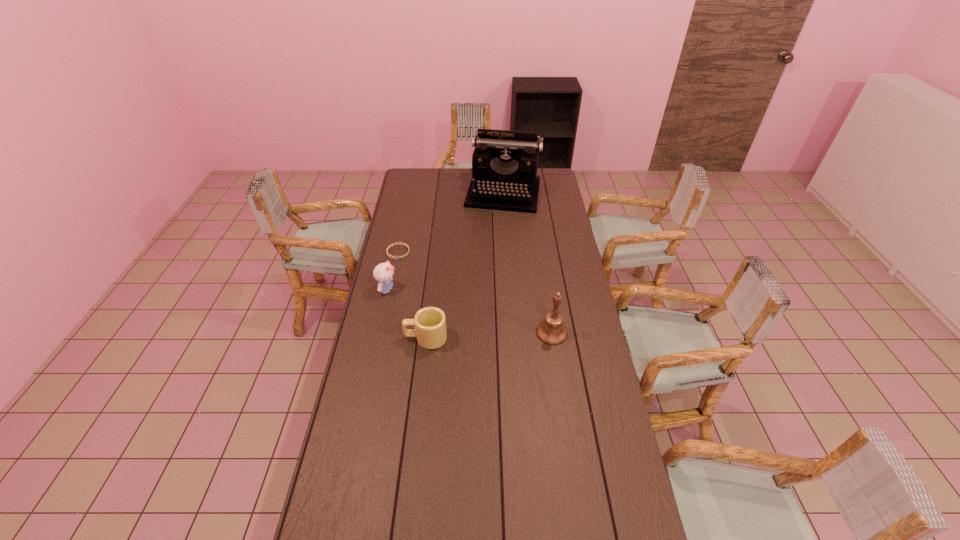
At what (x,y) coordinates should I click in order to perform the action: click on vacant spot on the desktop that is between the third object from right to left and the fourth shortest object and is positioned on the front-facing side of the third tallest object. Please return your answer as a coordinate pair (x, y). Looking at the image, I should click on click(x=501, y=335).

Locate an element on the screen. The width and height of the screenshot is (960, 540). free spot on the desktop that is between the second shortest object and the bell and is positioned on the typing side of the typewriter is located at coordinates (473, 336).

Locate an element on the screen. This screenshot has width=960, height=540. vacant space on the desktop that is between the mug and the fourth shortest object and is positioned on the surface of the fourth nearest object showing star-shaped elements is located at coordinates (507, 335).